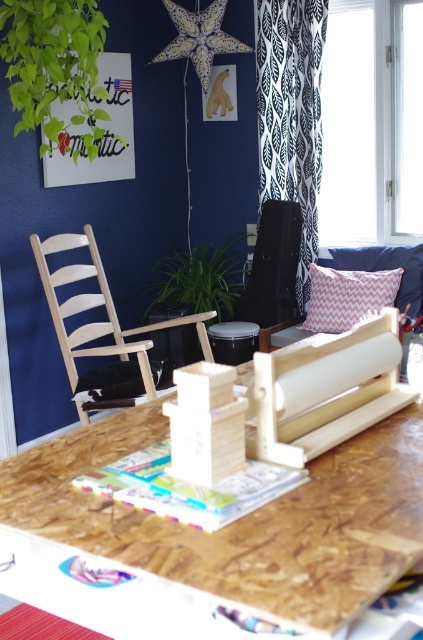
Based on the photo, is white chevron pillow at center smaller than matte black stool at center?

Incorrect, white chevron pillow at center is not smaller in size than matte black stool at center.

Is white chevron pillow at center above matte black stool at center?

No, white chevron pillow at center is not above matte black stool at center.

Which is in front, point (164, 368) or point (249, 342)?

Point (164, 368) is in front.

You are a GUI agent. You are given a task and a screenshot of the screen. Output one action in this format:
    pyautogui.click(x=<x>, y=<y>)
    Task: Click on the white chevron pillow at center
    The width and height of the screenshot is (423, 640).
    Given the screenshot: What is the action you would take?
    pyautogui.click(x=110, y=381)

I want to click on wooden table at center, so click(x=241, y=518).

Does point (409, 456) lie in front of point (65, 342)?

Yes.

Where is `wooden table at center`? The height and width of the screenshot is (640, 423). wooden table at center is located at coordinates coord(241,518).

The height and width of the screenshot is (640, 423). Identify the location of wooden table at center. coord(241,518).

Is point (318, 1) more distant than point (186, 442)?

Yes.

Who is taller, black printed fabric curtain at upper right or wooden blocks at center?

black printed fabric curtain at upper right is taller.

Who is more distant from viewer, (304,92) or (222,406)?

Point (304,92)

At what (x,y) coordinates should I click in order to perform the action: click on black printed fabric curtain at upper right. Please return your answer as a coordinate pair (x, y). Image resolution: width=423 pixels, height=640 pixels. Looking at the image, I should click on (291, 113).